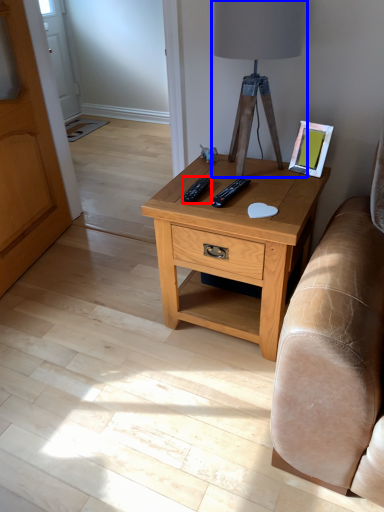
Question: Which object appears farthest to the camera in this image, remote (highlighted by a red box) or table lamp (highlighted by a blue box)?

Choices:
 (A) remote
 (B) table lamp

Answer: (A)